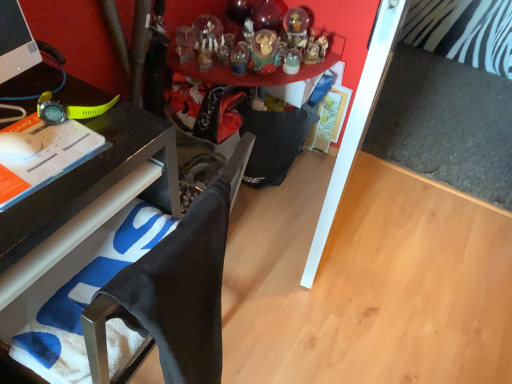
Describe the element at coordinates (264, 52) in the screenshot. I see `translucent glass ornament at upper center, which appears as the first toy when ordered from the bottom` at that location.

Describe the element at coordinates (296, 28) in the screenshot. The image size is (512, 384). I see `translucent glass snow globe at upper center, the second toy when ordered from bottom to top` at that location.

Identify the location of matte black watch at left. The height and width of the screenshot is (384, 512). (51, 110).

Is point (305, 37) more distant than point (42, 100)?

Yes, point (305, 37) is farther from viewer.

Does translucent glass snow globe at upper center, the second toy when ordered from bottom to top, turn towards matte black watch at left?

Yes, translucent glass snow globe at upper center, the second toy when ordered from bottom to top, is oriented towards matte black watch at left.

Is translucent glass snow globe at upper center, the second toy when ordered from bottom to top, situated inside matte black watch at left or outside?

translucent glass snow globe at upper center, the second toy when ordered from bottom to top, is outside matte black watch at left.

Are translucent glass snow globe at upper center, the second toy when ordered from bottom to top, and matte black watch at left far apart?

Yes, translucent glass snow globe at upper center, the second toy when ordered from bottom to top, and matte black watch at left are located far from each other.

From the image's perspective, is matte black watch at left located above or below translucent glass snow globe at upper center, the second toy when ordered from bottom to top?

Based on their image positions, matte black watch at left is located beneath translucent glass snow globe at upper center, the second toy when ordered from bottom to top.

The image size is (512, 384). Identify the location of watch located in front of the translucent glass snow globe at upper center, the 2th toy viewed from the top. (51, 110).

Considering the points (52, 122) and (302, 18), which point is behind, point (52, 122) or point (302, 18)?

The point (302, 18) is behind.

From the image's perspective, is translucent glass snow globe at upper center, the 2th toy viewed from the top, located above or below translucent glass ornament at upper center, which appears as the first toy when ordered from the bottom?

translucent glass snow globe at upper center, the 2th toy viewed from the top, is above translucent glass ornament at upper center, which appears as the first toy when ordered from the bottom.

From the picture: From a real-world perspective, is translucent glass snow globe at upper center, the 2th toy viewed from the top, physically located above or below translucent glass ornament at upper center, the third toy positioned from the top?

From a real-world perspective, translucent glass snow globe at upper center, the 2th toy viewed from the top, is physically above translucent glass ornament at upper center, the third toy positioned from the top.

Is translucent glass snow globe at upper center, the 2th toy viewed from the top, completely or partially outside of translucent glass ornament at upper center, which appears as the first toy when ordered from the bottom?

Yes.

Considering the relative sizes of translucent glass snow globe at upper center, the 2th toy viewed from the top, and translucent glass ornament at upper center, which appears as the first toy when ordered from the bottom, in the image provided, is translucent glass snow globe at upper center, the 2th toy viewed from the top, bigger than translucent glass ornament at upper center, which appears as the first toy when ordered from the bottom,?

Incorrect, translucent glass snow globe at upper center, the 2th toy viewed from the top, is not larger than translucent glass ornament at upper center, which appears as the first toy when ordered from the bottom.

Does black glossy desk at left have a lesser width compared to translucent glass ornament at upper center, the 1th toy from the top?

No, black glossy desk at left is not thinner than translucent glass ornament at upper center, the 1th toy from the top.

Is black glossy desk at left taller than translucent glass ornament at upper center, the 3th toy from the bottom?

Yes.

From the image's perspective, is black glossy desk at left on top of translucent glass ornament at upper center, the 1th toy from the top?

No.

Is translucent glass snow globe at upper center, the 2th toy viewed from the top, at the back of black fabric computer chair at lower left?

No, translucent glass snow globe at upper center, the 2th toy viewed from the top, is not at the back of black fabric computer chair at lower left.

Between black fabric computer chair at lower left and translucent glass snow globe at upper center, the second toy when ordered from bottom to top, which one appears on the left side from the viewer's perspective?

black fabric computer chair at lower left is more to the left.

From the picture: From the image's perspective, would you say black fabric computer chair at lower left is shown under translucent glass snow globe at upper center, the 2th toy viewed from the top?

Correct, black fabric computer chair at lower left appears lower than translucent glass snow globe at upper center, the 2th toy viewed from the top, in the image.

Between point (80, 180) and point (269, 56), which one is positioned behind?

The point (269, 56) is behind.

Does black glossy desk at left have a lesser width compared to translucent glass ornament at upper center, which appears as the first toy when ordered from the bottom?

No.

Could you tell me if black glossy desk at left is facing translucent glass ornament at upper center, which appears as the first toy when ordered from the bottom?

No, black glossy desk at left is not facing towards translucent glass ornament at upper center, which appears as the first toy when ordered from the bottom.

Find the location of a particular element. The image size is (512, 384). desk on the left of translucent glass ornament at upper center, which appears as the first toy when ordered from the bottom is located at coordinates point(93,180).

Can you confirm if translucent glass ornament at upper center, the third toy positioned from the top, is shorter than black glossy desk at left?

Yes.

From a real-world perspective, is translucent glass ornament at upper center, which appears as the first toy when ordered from the bottom, above or below black glossy desk at left?

translucent glass ornament at upper center, which appears as the first toy when ordered from the bottom, is above black glossy desk at left.

Which object is positioned more to the right, translucent glass ornament at upper center, the third toy positioned from the top, or black glossy desk at left?

translucent glass ornament at upper center, the third toy positioned from the top.

Locate an element on the screen. watch to the left of translucent glass snow globe at upper center, the second toy when ordered from bottom to top is located at coordinates (51, 110).

The image size is (512, 384). There is a translucent glass snow globe at upper center, the second toy when ordered from bottom to top. Identify the location of watch above it (from a real-world perspective). (51, 110).

Based on their spatial positions, is black fabric computer chair at lower left or translucent glass ornament at upper center, the 1th toy from the top, further from black glossy desk at left?

translucent glass ornament at upper center, the 1th toy from the top, is positioned further to the anchor black glossy desk at left.

Looking at the image, which one is located closer to black fabric computer chair at lower left, matte black watch at left or translucent glass ornament at upper center, the third toy positioned from the top?

matte black watch at left.

Considering their positions, is translucent glass ornament at upper center, the third toy positioned from the top, positioned closer to black glossy desk at left than matte black watch at left?

Among the two, matte black watch at left is located nearer to black glossy desk at left.

Estimate the real-world distances between objects in this image. Which object is further from translucent glass ornament at upper center, the 3th toy from the bottom, black glossy desk at left or translucent glass snow globe at upper center, the 2th toy viewed from the top?

black glossy desk at left is positioned further to the anchor translucent glass ornament at upper center, the 3th toy from the bottom.

Considering their positions, is black glossy desk at left positioned further to translucent glass ornament at upper center, the third toy positioned from the top, than translucent glass ornament at upper center, the 1th toy from the top?

The object further to translucent glass ornament at upper center, the third toy positioned from the top, is black glossy desk at left.

Which object lies nearer to the anchor point black glossy desk at left, matte black watch at left or translucent glass snow globe at upper center, the second toy when ordered from bottom to top?

Based on the image, matte black watch at left appears to be nearer to black glossy desk at left.

Considering their positions, is translucent glass ornament at upper center, which appears as the first toy when ordered from the bottom, positioned further to black fabric computer chair at lower left than translucent glass snow globe at upper center, the 2th toy viewed from the top?

Among the two, translucent glass snow globe at upper center, the 2th toy viewed from the top, is located further to black fabric computer chair at lower left.

When comparing their distances from matte black watch at left, does black glossy desk at left or translucent glass snow globe at upper center, the 2th toy viewed from the top, seem further?

Among the two, translucent glass snow globe at upper center, the 2th toy viewed from the top, is located further to matte black watch at left.

This screenshot has height=384, width=512. In order to click on watch between black glossy desk at left and translucent glass snow globe at upper center, the second toy when ordered from bottom to top, along the z-axis in this screenshot , I will do `click(51, 110)`.

Where is `watch between black glossy desk at left and translucent glass ornament at upper center, which appears as the first toy when ordered from the bottom, along the z-axis`? The height and width of the screenshot is (384, 512). watch between black glossy desk at left and translucent glass ornament at upper center, which appears as the first toy when ordered from the bottom, along the z-axis is located at coordinates (51, 110).

The image size is (512, 384). In order to click on watch between black fabric computer chair at lower left and translucent glass ornament at upper center, the 3th toy from the bottom, from front to back in this screenshot , I will do [x=51, y=110].

Locate an element on the screen. The image size is (512, 384). desk between black fabric computer chair at lower left and translucent glass ornament at upper center, the 3th toy from the bottom, from front to back is located at coordinates (93, 180).